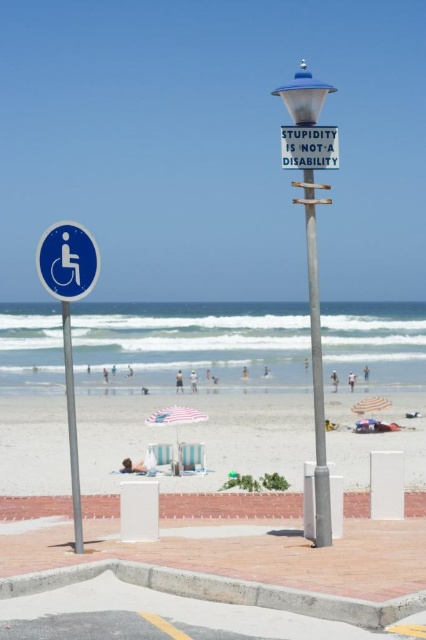
Between blue plastic wheelchair sign at left and silver metallic pole at left, which one appears on the right side from the viewer's perspective?

Positioned to the right is blue plastic wheelchair sign at left.

Is point (85, 291) farther from viewer compared to point (71, 392)?

Yes.

Does point (74, 244) come farther from viewer compared to point (65, 360)?

That is False.

Where is `blue plastic wheelchair sign at left`? blue plastic wheelchair sign at left is located at coordinates (68, 260).

From the picture: Is blue plastic wheelchair sign at left bigger than white plastic sign at upper center?

Indeed, blue plastic wheelchair sign at left has a larger size compared to white plastic sign at upper center.

Between blue plastic wheelchair sign at left and white plastic sign at upper center, which one is positioned higher?

white plastic sign at upper center is above.

Describe the element at coordinates (68, 260) in the screenshot. I see `blue plastic wheelchair sign at left` at that location.

Where is `blue plastic wheelchair sign at left`? The height and width of the screenshot is (640, 426). blue plastic wheelchair sign at left is located at coordinates (68, 260).

How much distance is there between silver metallic pole at center and blue plastic wheelchair sign at left?

5.43 feet

Does silver metallic pole at center come behind blue plastic wheelchair sign at left?

No, silver metallic pole at center is closer to the viewer.

Between point (310, 179) and point (94, 253), which one is positioned in front?

Positioned in front is point (310, 179).

Where is `silver metallic pole at center`? silver metallic pole at center is located at coordinates (316, 364).